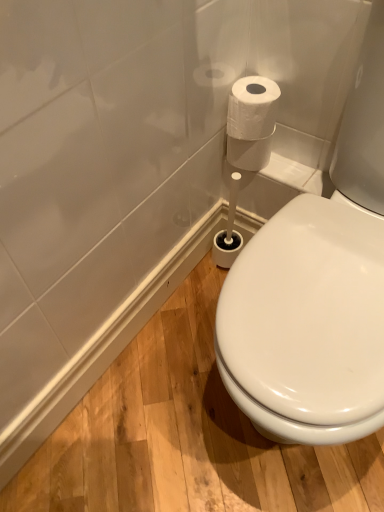
Question: Should I look upward or downward to see white paper at upper right?

Choices:
 (A) up
 (B) down

Answer: (A)